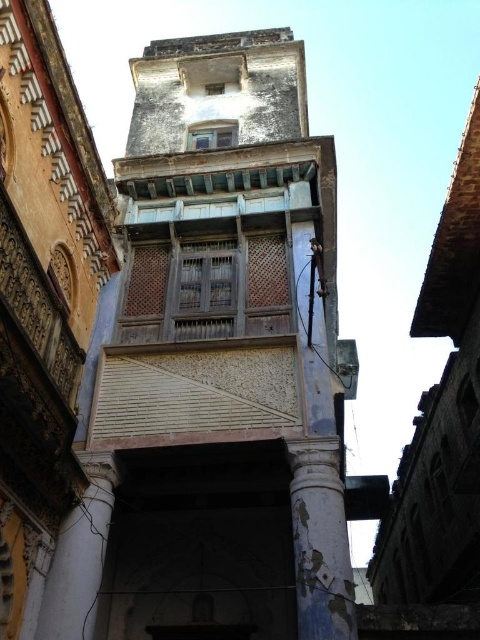
What are the coordinates of the blue painted wood bell tower at center?

The blue painted wood bell tower at center is located at coordinates point (214, 368).

You are an architect examining the old building. You need to assess the structural integrity of the peeling blue paint column at lower right and the white marble pillar at lower left. Which one is closer to the front of the building?

The peeling blue paint column at lower right is closer to the front of the building since it is in front of the white marble pillar at lower left.